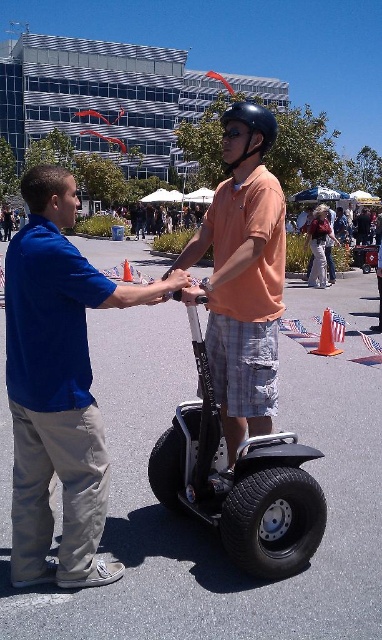
You are a photographer standing in the scene and want to take a photo of the blue cotton shirt at center and orange matte helmet at upper center. Which object should you focus on first if you want to capture both in the same frame without moving the camera?

The blue cotton shirt at center is located below the orange matte helmet at upper center, so you should focus on the orange matte helmet at upper center first to ensure both are in the frame.

You are a pedestrian trying to cross the street. You see an orange plastic cone at center and an orange traffic cone at center. Which one is more to the right?

The orange plastic cone at center is more to the right than the orange traffic cone at center.

You are standing at the point with coordinates 0.5, 0.8. You want to move towards the orange plastic cone at center. In which direction should you move?

The orange plastic cone at center is located at point [325,337]. Since you are at [305,320], you should move northeast to reach it.